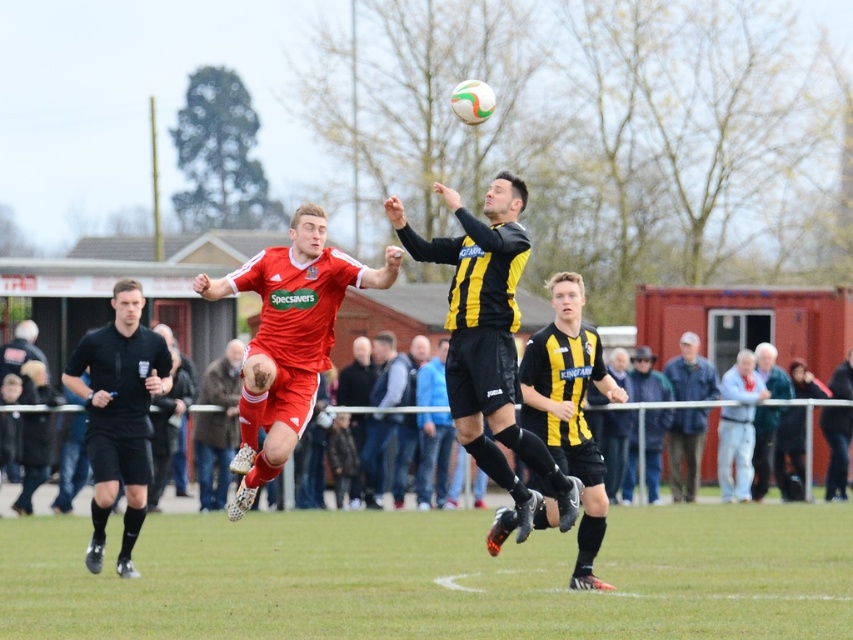
Question: Which point appears farthest from the camera in this image?

Choices:
 (A) (410, 433)
 (B) (273, 452)

Answer: (A)

Question: Is the position of blue denim jacket at lower right more distant than that of black leather jacket at center?

Choices:
 (A) no
 (B) yes

Answer: (B)

Question: Does green grass football field at center have a greater width compared to matte red shorts at center?

Choices:
 (A) yes
 (B) no

Answer: (A)

Question: Which object appears closest to the camera in this image?

Choices:
 (A) blue jersey at center
 (B) black/yellow striped jersey at center
 (C) matte red shorts at center

Answer: (B)

Question: Can you confirm if matte red shorts at center is bigger than dark gray jacket at right?

Choices:
 (A) yes
 (B) no

Answer: (A)

Question: Which object appears farthest from the camera in this image?

Choices:
 (A) matte red jersey at center
 (B) blue denim jacket at lower right
 (C) black matte referee at left

Answer: (B)